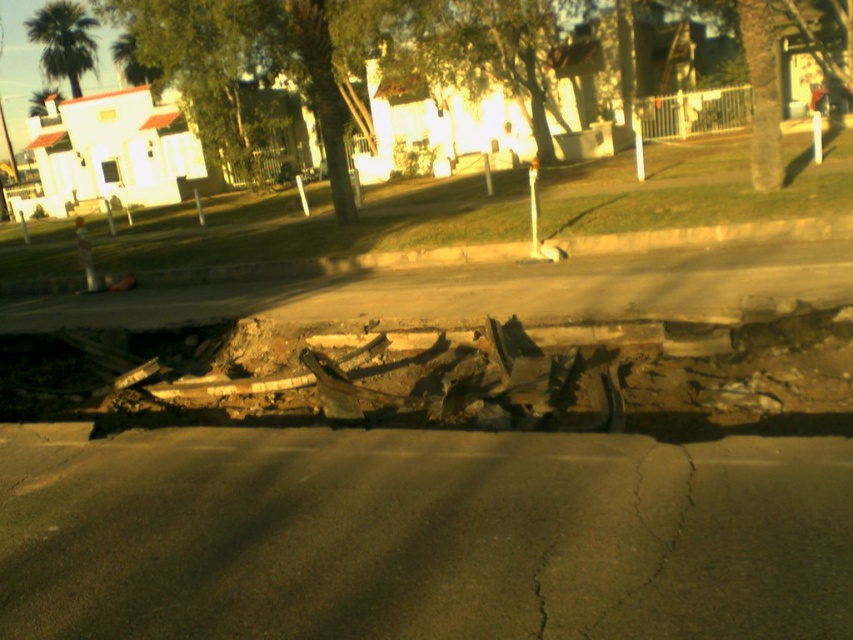
You are standing at the point with coordinates point (218, 266) and want to walk to the point with coordinates point (469, 368). Given the disrupted road and exposed infrastructure in the scene, is the path between these two points clear enough for safe walking?

The path between point (469, 368) and point (218, 266) is blocked by the disrupted road and exposed infrastructure, making it unsafe for walking.

In the scene shown: You are a delivery driver who needs to navigate a narrow alley that is only 1.2 meters wide. You see the rusty concrete rubble at center and the brown concrete curb at upper center in the scene. Which object would require you to adjust your driving path more due to its width?

The brown concrete curb at upper center has a greater width than the rusty concrete rubble at center, so it would require more adjustment to your driving path.

You are a delivery driver approaching the intersection in the image. You need to avoid the rusty concrete rubble at center and the brown concrete curb at upper center. Based on their positions, which object should you steer around first as you approach from the left side of the road?

The brown concrete curb at upper center should be steered around first because it is located to the left of the rusty concrete rubble at center, meaning it comes into view sooner when approaching from the left side of the road.